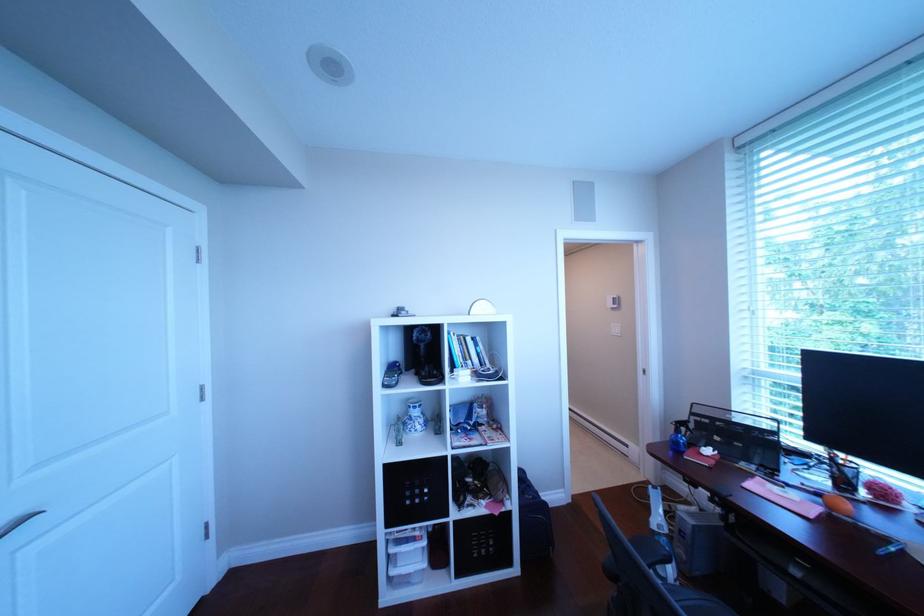
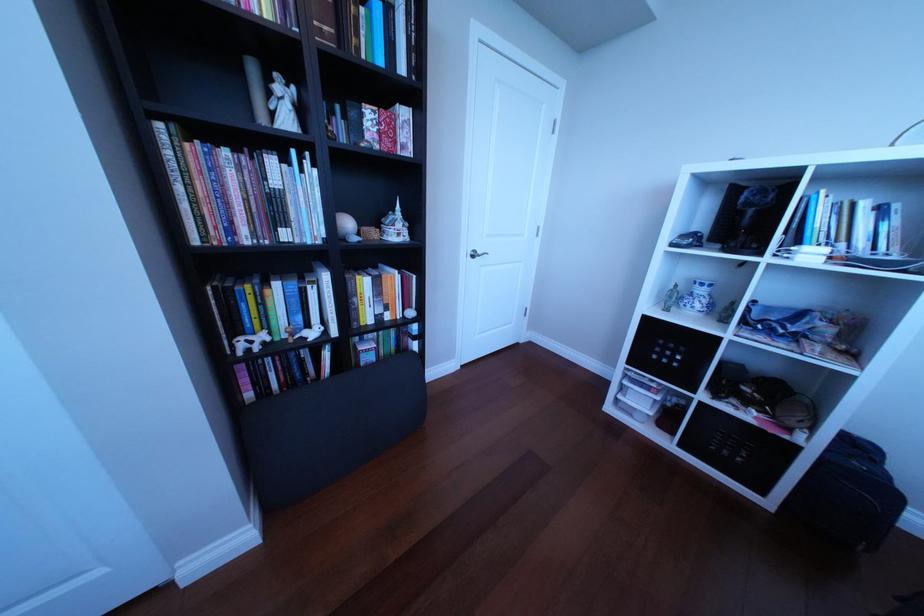
The first image is from the beginning of the video and the second image is from the end. How did the camera likely rotate when shooting the video?

The camera rotated toward left-down.